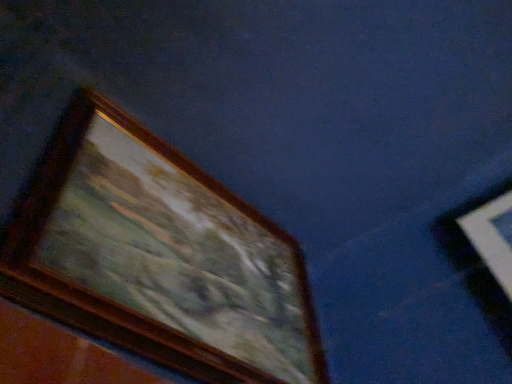
Question: Should I look upward or downward to see wooden picture frame at upper left?

Choices:
 (A) down
 (B) up

Answer: (A)